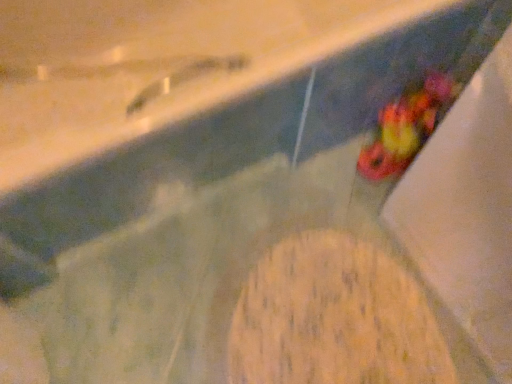
The width and height of the screenshot is (512, 384). What do you see at coordinates (334, 318) in the screenshot?
I see `wooden cutting board at center, which is the second food in top-to-bottom order` at bounding box center [334, 318].

In order to face wooden cutting board at center, which is the second food in top-to-bottom order, should I rotate leftwards or rightwards?

Rotate your view right by about 9.069°.

At what (x,y) coordinates should I click in order to perform the action: click on wooden cutting board at center, which is the second food in top-to-bottom order. Please return your answer as a coordinate pair (x, y). The width and height of the screenshot is (512, 384). Looking at the image, I should click on (x=334, y=318).

Identify the location of multicolored plastic toy at lower right, arranged as the second food when ordered from the bottom. The height and width of the screenshot is (384, 512). (406, 127).

What do you see at coordinates (406, 127) in the screenshot?
I see `multicolored plastic toy at lower right, arranged as the second food when ordered from the bottom` at bounding box center [406, 127].

I want to click on wooden cutting board at center, which is the second food in top-to-bottom order, so click(334, 318).

Between multicolored plastic toy at lower right, arranged as the second food when ordered from the bottom, and wooden cutting board at center, which is the second food in top-to-bottom order, which one appears on the left side from the viewer's perspective?

Positioned to the left is wooden cutting board at center, which is the second food in top-to-bottom order.

Consider the image. Considering their positions, is multicolored plastic toy at lower right, arranged as the second food when ordered from the bottom, located in front of or behind wooden cutting board at center, which is the second food in top-to-bottom order?

Clearly, multicolored plastic toy at lower right, arranged as the second food when ordered from the bottom, is behind wooden cutting board at center, which is the second food in top-to-bottom order.

Which is closer, (419, 119) or (250, 289)?

Positioned in front is point (250, 289).

From the image's perspective, which is above, multicolored plastic toy at lower right, marked as the first food in a top-to-bottom arrangement, or wooden cutting board at center, the first food when ordered from bottom to top?

multicolored plastic toy at lower right, marked as the first food in a top-to-bottom arrangement, appears higher in the image.

From a real-world perspective, is multicolored plastic toy at lower right, marked as the first food in a top-to-bottom arrangement, positioned under wooden cutting board at center, the first food when ordered from bottom to top, based on gravity?

Incorrect, from a real-world perspective, multicolored plastic toy at lower right, marked as the first food in a top-to-bottom arrangement, is higher than wooden cutting board at center, the first food when ordered from bottom to top.

Does multicolored plastic toy at lower right, arranged as the second food when ordered from the bottom, have a greater width compared to wooden cutting board at center, which is the second food in top-to-bottom order?

Incorrect, the width of multicolored plastic toy at lower right, arranged as the second food when ordered from the bottom, does not surpass that of wooden cutting board at center, which is the second food in top-to-bottom order.

Who is taller, multicolored plastic toy at lower right, marked as the first food in a top-to-bottom arrangement, or wooden cutting board at center, the first food when ordered from bottom to top?

multicolored plastic toy at lower right, marked as the first food in a top-to-bottom arrangement, is taller.

Does multicolored plastic toy at lower right, marked as the first food in a top-to-bottom arrangement, have a larger size compared to wooden cutting board at center, the first food when ordered from bottom to top?

No, multicolored plastic toy at lower right, marked as the first food in a top-to-bottom arrangement, is not bigger than wooden cutting board at center, the first food when ordered from bottom to top.

Can we say multicolored plastic toy at lower right, marked as the first food in a top-to-bottom arrangement, lies outside wooden cutting board at center, the first food when ordered from bottom to top?

Absolutely, multicolored plastic toy at lower right, marked as the first food in a top-to-bottom arrangement, is external to wooden cutting board at center, the first food when ordered from bottom to top.

Is multicolored plastic toy at lower right, marked as the first food in a top-to-bottom arrangement, in contact with wooden cutting board at center, the first food when ordered from bottom to top?

No, multicolored plastic toy at lower right, marked as the first food in a top-to-bottom arrangement, is not making contact with wooden cutting board at center, the first food when ordered from bottom to top.

Is multicolored plastic toy at lower right, marked as the first food in a top-to-bottom arrangement, looking in the opposite direction of wooden cutting board at center, which is the second food in top-to-bottom order?

multicolored plastic toy at lower right, marked as the first food in a top-to-bottom arrangement, does not have its back to wooden cutting board at center, which is the second food in top-to-bottom order.

How different are the orientations of multicolored plastic toy at lower right, arranged as the second food when ordered from the bottom, and wooden cutting board at center, the first food when ordered from bottom to top, in degrees?

There is a 1.82-degree angle between the facing directions of multicolored plastic toy at lower right, arranged as the second food when ordered from the bottom, and wooden cutting board at center, the first food when ordered from bottom to top.

This screenshot has width=512, height=384. In order to click on food below the multicolored plastic toy at lower right, marked as the first food in a top-to-bottom arrangement (from a real-world perspective) in this screenshot , I will do `click(334, 318)`.

Which is more to the right, wooden cutting board at center, which is the second food in top-to-bottom order, or multicolored plastic toy at lower right, arranged as the second food when ordered from the bottom?

multicolored plastic toy at lower right, arranged as the second food when ordered from the bottom.

Relative to multicolored plastic toy at lower right, arranged as the second food when ordered from the bottom, is wooden cutting board at center, which is the second food in top-to-bottom order, in front or behind?

wooden cutting board at center, which is the second food in top-to-bottom order, is positioned closer to the viewer than multicolored plastic toy at lower right, arranged as the second food when ordered from the bottom.

Between point (367, 362) and point (441, 84), which one is positioned behind?

Positioned behind is point (441, 84).

From the image's perspective, which is above, wooden cutting board at center, the first food when ordered from bottom to top, or multicolored plastic toy at lower right, marked as the first food in a top-to-bottom arrangement?

multicolored plastic toy at lower right, marked as the first food in a top-to-bottom arrangement, from the image's perspective.

From a real-world perspective, relative to multicolored plastic toy at lower right, arranged as the second food when ordered from the bottom, is wooden cutting board at center, the first food when ordered from bottom to top, vertically above or below?

In terms of real-world spatial position, wooden cutting board at center, the first food when ordered from bottom to top, is below multicolored plastic toy at lower right, arranged as the second food when ordered from the bottom.

Between wooden cutting board at center, which is the second food in top-to-bottom order, and multicolored plastic toy at lower right, marked as the first food in a top-to-bottom arrangement, which one has smaller width?

With smaller width is multicolored plastic toy at lower right, marked as the first food in a top-to-bottom arrangement.

From their relative heights in the image, would you say wooden cutting board at center, which is the second food in top-to-bottom order, is taller or shorter than multicolored plastic toy at lower right, arranged as the second food when ordered from the bottom?

Considering their sizes, wooden cutting board at center, which is the second food in top-to-bottom order, has less height than multicolored plastic toy at lower right, arranged as the second food when ordered from the bottom.

Is wooden cutting board at center, which is the second food in top-to-bottom order, bigger than multicolored plastic toy at lower right, marked as the first food in a top-to-bottom arrangement?

Indeed, wooden cutting board at center, which is the second food in top-to-bottom order, has a larger size compared to multicolored plastic toy at lower right, marked as the first food in a top-to-bottom arrangement.

From the picture: Would you say wooden cutting board at center, the first food when ordered from bottom to top, contains multicolored plastic toy at lower right, arranged as the second food when ordered from the bottom?

Definitely not — multicolored plastic toy at lower right, arranged as the second food when ordered from the bottom, is not inside wooden cutting board at center, the first food when ordered from bottom to top.

Are wooden cutting board at center, which is the second food in top-to-bottom order, and multicolored plastic toy at lower right, arranged as the second food when ordered from the bottom, located far from each other?

wooden cutting board at center, which is the second food in top-to-bottom order, is near multicolored plastic toy at lower right, arranged as the second food when ordered from the bottom, not far away.

Is wooden cutting board at center, which is the second food in top-to-bottom order, facing away from multicolored plastic toy at lower right, marked as the first food in a top-to-bottom arrangement?

No.

How much distance is there between wooden cutting board at center, which is the second food in top-to-bottom order, and multicolored plastic toy at lower right, arranged as the second food when ordered from the bottom?

A distance of 17.24 inches exists between wooden cutting board at center, which is the second food in top-to-bottom order, and multicolored plastic toy at lower right, arranged as the second food when ordered from the bottom.

The height and width of the screenshot is (384, 512). In order to click on food above the wooden cutting board at center, the first food when ordered from bottom to top (from the image's perspective) in this screenshot , I will do `click(406, 127)`.

The image size is (512, 384). I want to click on food that appears below the multicolored plastic toy at lower right, marked as the first food in a top-to-bottom arrangement (from a real-world perspective), so click(334, 318).

Find the location of a particular element. food lying above the wooden cutting board at center, the first food when ordered from bottom to top (from the image's perspective) is located at coordinates (406, 127).